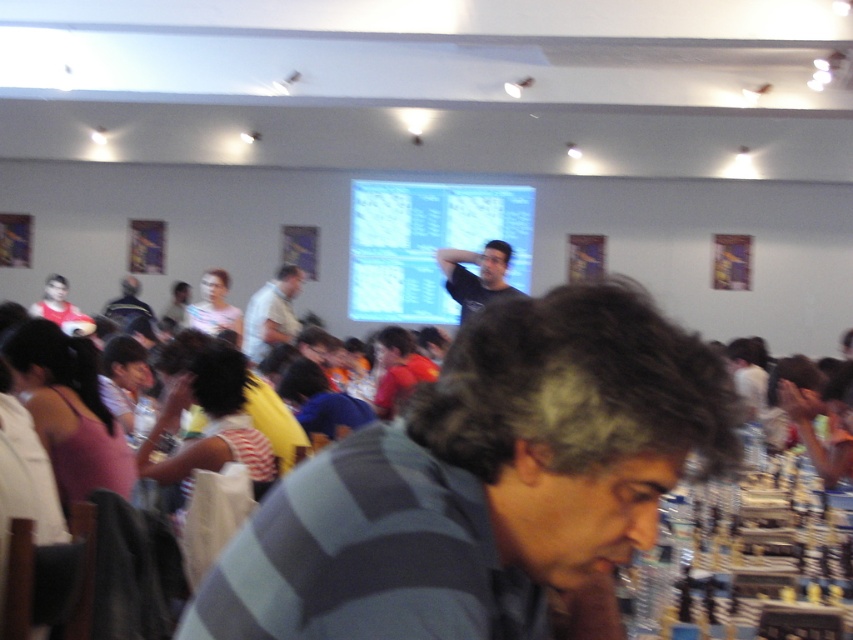
You are a photographer in the conference room and want to capture a photo of both the gray striped shirt at center and the light gray shirt at center without any obstruction. Since you can only move left or right, which direction should you move to ensure both are visible in the frame?

The gray striped shirt at center is to the right of light gray shirt at center, so moving to the left would allow both to be visible in the frame without obstruction.

You are standing in the conference room and want to take a photo of both the point at (515,241) and the point at (491,276). Which point should you focus on first to ensure both are in sharp focus?

You should focus on the point at (515,241) first because it is closer to the camera than the point at (491,276). By focusing on the closer point, the farther point may also fall within the depth of field, ensuring both are in focus.